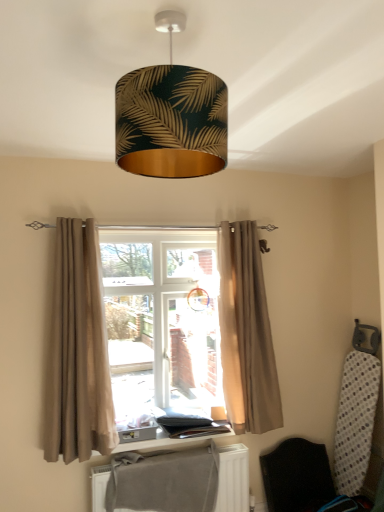
At what (x,y) coordinates should I click in order to perform the action: click on free spot above gray fabric at lower center (from a real-world perspective). Please return your answer as a coordinate pair (x, y). Looking at the image, I should click on (172, 452).